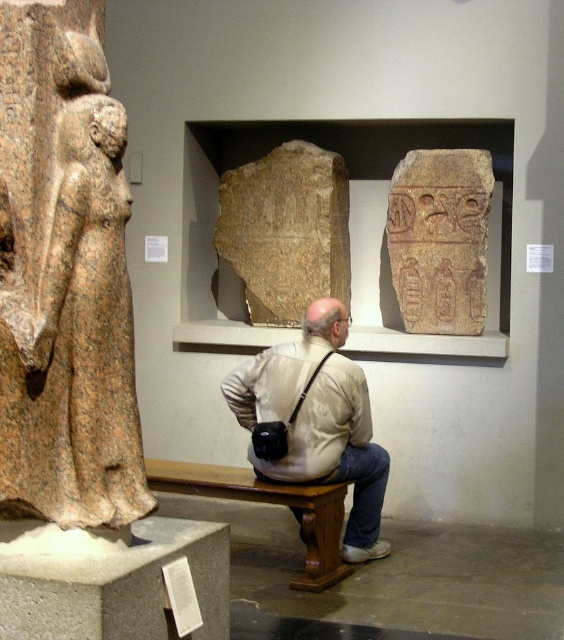
Question: Is brown stone statue at left thinner than brown stone slab at center?

Choices:
 (A) no
 (B) yes

Answer: (B)

Question: Is brown stone slab at center thinner than brown wooden bench at lower center?

Choices:
 (A) no
 (B) yes

Answer: (B)

Question: Which of the following is the closest to the observer?

Choices:
 (A) (259, 278)
 (B) (80, 276)
 (C) (400, 180)

Answer: (B)

Question: Observing the image, what is the correct spatial positioning of brown stone statue at left in reference to brown stone slab at center?

Choices:
 (A) right
 (B) left

Answer: (B)

Question: Which object is farther from the camera taking this photo?

Choices:
 (A) brown stone statue at left
 (B) light beige shirt at center
 (C) brown stone slab at center
 (D) brown wooden bench at lower center

Answer: (C)

Question: Which of these objects is positioned farthest from the brown stone hieroglyphics at center?

Choices:
 (A) brown stone slab at center
 (B) brown wooden bench at lower center
 (C) light beige shirt at center

Answer: (B)